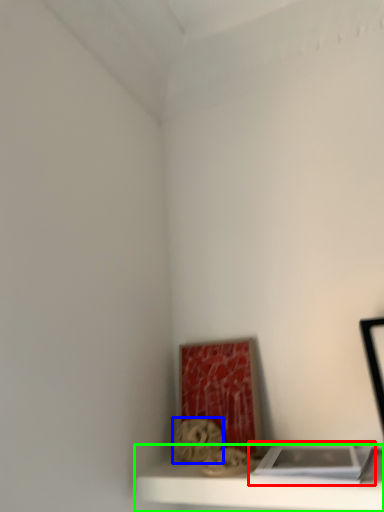
Question: Which object is positioned closest to book (highlighted by a red box)? Select from art (highlighted by a blue box) and shelf (highlighted by a green box).

Choices:
 (A) art
 (B) shelf

Answer: (B)